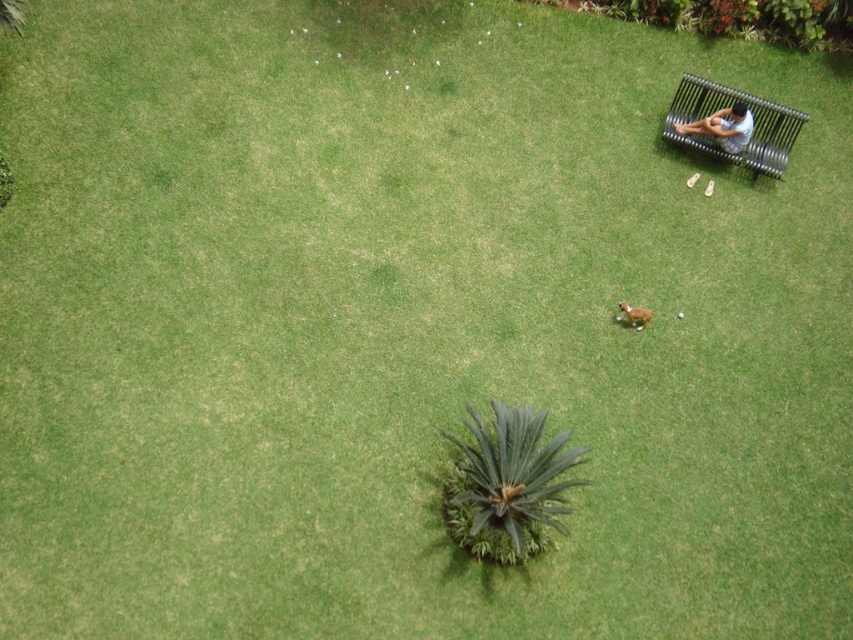
Question: Can you confirm if metallic silver park bench at upper right is thinner than light blue fabric bench at upper right?

Choices:
 (A) no
 (B) yes

Answer: (A)

Question: Which object appears closest to the camera in this image?

Choices:
 (A) metallic silver park bench at upper right
 (B) light blue fabric bench at upper right
 (C) brown furry dog at center

Answer: (C)

Question: Is the position of metallic silver park bench at upper right more distant than that of light blue fabric bench at upper right?

Choices:
 (A) no
 (B) yes

Answer: (B)

Question: Which is nearer to the metallic silver park bench at upper right?

Choices:
 (A) brown furry dog at center
 (B) light blue fabric bench at upper right

Answer: (B)

Question: Among these objects, which one is farthest from the camera?

Choices:
 (A) light blue fabric bench at upper right
 (B) brown furry dog at center
 (C) metallic silver park bench at upper right

Answer: (C)

Question: Does metallic silver park bench at upper right appear over light blue fabric bench at upper right?

Choices:
 (A) no
 (B) yes

Answer: (B)